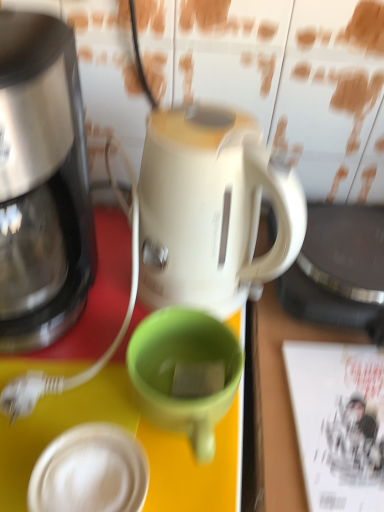
Where is `empty space that is ontop of white paper magazine at right (from a real-world perspective)`? The width and height of the screenshot is (384, 512). empty space that is ontop of white paper magazine at right (from a real-world perspective) is located at coordinates (348, 405).